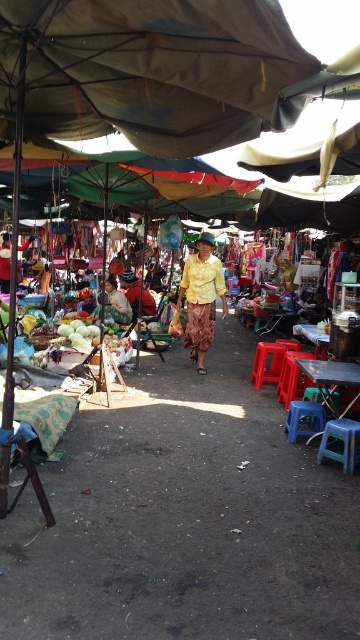
You are a customer at the market and need to sit down for a moment. There is a yellow plastic stool at lower right and a brown canvas canopy at upper center. Which object can you sit on?

The yellow plastic stool at lower right is the object you can sit on. The brown canvas canopy at upper center is larger in size but is likely part of the market stall structure and not meant for sitting.

In the scene shown: You are standing in the market and want to take a photo of the brown canvas canopy at upper center. Your camera is on a tripod that requires a minimum distance of 5 feet to focus properly. Can you take the photo from where you are?

The brown canvas canopy at upper center and camera are 5.03 feet apart, so yes, you can take the photo because the distance is just over the required 5 feet.